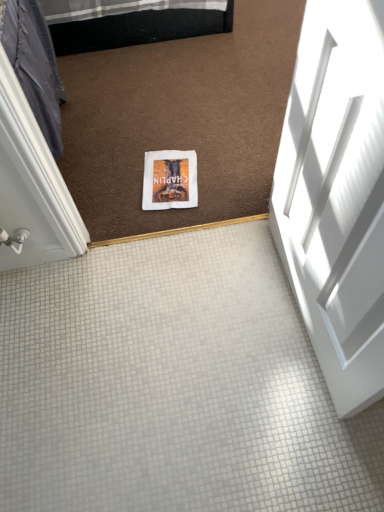
At what (x,y) coordinates should I click in order to perform the action: click on white glossy door at right. Please return your answer as a coordinate pair (x, y). This screenshot has height=512, width=384. Looking at the image, I should click on (336, 195).

Describe the element at coordinates (336, 195) in the screenshot. The image size is (384, 512). I see `white glossy door at right` at that location.

What do you see at coordinates (170, 180) in the screenshot?
I see `white paper at center` at bounding box center [170, 180].

Locate an element on the screen. This screenshot has width=384, height=512. white paper at center is located at coordinates (170, 180).

Where is `white glossy door at right`? white glossy door at right is located at coordinates (336, 195).

Is white glossy door at right at the left side of white paper at center?

In fact, white glossy door at right is to the right of white paper at center.

In the image, is white glossy door at right positioned in front of or behind white paper at center?

Clearly, white glossy door at right is in front of white paper at center.

Does point (303, 263) appear closer or farther from the camera than point (151, 169)?

Point (303, 263) is positioned closer to the camera compared to point (151, 169).

Based on the photo, from the image's perspective, is white glossy door at right on white paper at center?

No, from the image's perspective, white glossy door at right is not above white paper at center.

From a real-world perspective, is white glossy door at right on white paper at center?

Yes, from a real-world perspective, white glossy door at right is on top of white paper at center.

Which of these two, white glossy door at right or white paper at center, is wider?

white paper at center is wider.

Who is shorter, white glossy door at right or white paper at center?

white paper at center.

Based on their sizes in the image, would you say white glossy door at right is bigger or smaller than white paper at center?

Considering their sizes, white glossy door at right takes up more space than white paper at center.

Is white glossy door at right inside the boundaries of white paper at center, or outside?

The correct answer is: outside.

Is white glossy door at right not near white paper at center?

No, white glossy door at right is in close proximity to white paper at center.

Is white glossy door at right facing towards white paper at center?

No.

What's the angular difference between white glossy door at right and white paper at center's facing directions?

There is a 99.8-degree angle between the facing directions of white glossy door at right and white paper at center.

Measure the distance between white glossy door at right and white paper at center.

white glossy door at right and white paper at center are 25.59 inches apart from each other.

I want to click on flyer on the left of white glossy door at right, so click(x=170, y=180).

Consider the image. Considering the relative positions of white paper at center and white glossy door at right in the image provided, is white paper at center to the left of white glossy door at right from the viewer's perspective?

Yes, white paper at center is to the left of white glossy door at right.

Between white paper at center and white glossy door at right, which one is positioned behind?

white paper at center is further from the camera.

Is point (166, 170) behind point (333, 358)?

Yes, it is behind point (333, 358).

From the image's perspective, which one is positioned lower, white paper at center or white glossy door at right?

white glossy door at right is shown below in the image.

From a real-world perspective, which object rests below the other?

white paper at center is physically lower.

Is white paper at center wider or thinner than white glossy door at right?

white paper at center is wider than white glossy door at right.

In the scene shown: Who is shorter, white paper at center or white glossy door at right?

white paper at center is shorter.

Which of these two, white paper at center or white glossy door at right, is smaller?

With smaller size is white paper at center.

Is white paper at center spatially inside white glossy door at right, or outside of it?

white paper at center is spatially situated outside white glossy door at right.

Is white paper at center next to white glossy door at right and touching it?

A: No, white paper at center is not next to white glossy door at right.

Is white glossy door at right at the back of white paper at center?

white paper at center does not have its back to white glossy door at right.

Can you tell me how much white paper at center and white glossy door at right differ in facing direction?

There is a 99.8-degree angle between the facing directions of white paper at center and white glossy door at right.

This screenshot has width=384, height=512. There is a white paper at center. What are the coordinates of `door above it (from a real-world perspective)` in the screenshot? It's located at (336, 195).

This screenshot has height=512, width=384. I want to click on flyer below the white glossy door at right (from a real-world perspective), so click(170, 180).

At what (x,y) coordinates should I click in order to perform the action: click on door in front of the white paper at center. Please return your answer as a coordinate pair (x, y). Looking at the image, I should click on (336, 195).